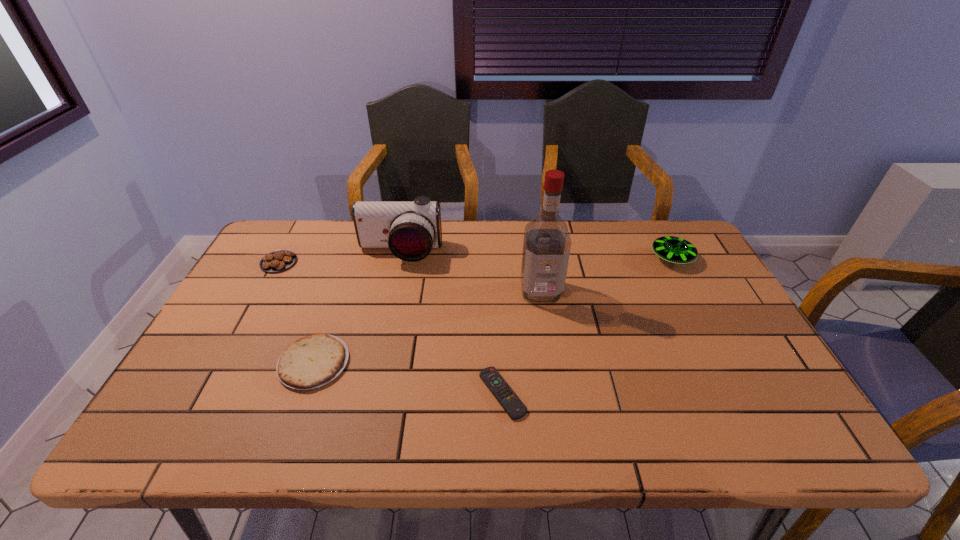
Locate an element on the screen. This screenshot has width=960, height=540. the tallest object is located at coordinates (546, 248).

Identify the location of liquor. (546, 248).

You are a GUI agent. You are given a task and a screenshot of the screen. Output one action in this format:
    pyautogui.click(x=<x>, y=<y>)
    Task: Click on the camcorder
    The image size is (960, 540).
    Given the screenshot: What is the action you would take?
    pyautogui.click(x=410, y=229)

Find the location of a particular element. The height and width of the screenshot is (540, 960). the rightmost object is located at coordinates (672, 249).

Locate an element on the screen. The image size is (960, 540). the third tallest object is located at coordinates (672, 249).

At what (x,y) coordinates should I click in order to perform the action: click on the leftmost object. Please return your answer as a coordinate pair (x, y). This screenshot has width=960, height=540. Looking at the image, I should click on (279, 260).

This screenshot has height=540, width=960. What are the coordinates of `tortilla` in the screenshot? It's located at (312, 361).

Identify the location of the third object from right to left. This screenshot has height=540, width=960. (511, 403).

In order to click on remote control in this screenshot , I will do `click(511, 403)`.

Identify the location of vacant space located on the front-facing side of the fourth farthest object. This screenshot has height=540, width=960. (550, 350).